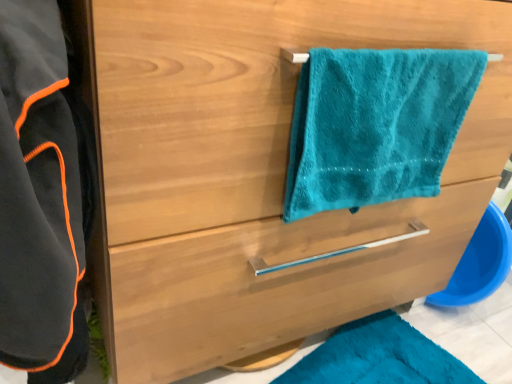
Question: Is teal plush towel at upper right to the left of black fleece bathrobe at left from the viewer's perspective?

Choices:
 (A) yes
 (B) no

Answer: (B)

Question: Considering the relative sizes of teal plush towel at upper right and black fleece bathrobe at left in the image provided, is teal plush towel at upper right shorter than black fleece bathrobe at left?

Choices:
 (A) yes
 (B) no

Answer: (A)

Question: Is teal plush towel at upper right thinner than black fleece bathrobe at left?

Choices:
 (A) no
 (B) yes

Answer: (B)

Question: Is there a large distance between teal plush towel at upper right and black fleece bathrobe at left?

Choices:
 (A) yes
 (B) no

Answer: (B)

Question: From the image's perspective, is teal plush towel at upper right beneath black fleece bathrobe at left?

Choices:
 (A) no
 (B) yes

Answer: (A)

Question: Is the depth of teal plush towel at upper right greater than that of black fleece bathrobe at left?

Choices:
 (A) no
 (B) yes

Answer: (B)

Question: Is black fleece bathrobe at left shorter than teal plush towel at upper right?

Choices:
 (A) no
 (B) yes

Answer: (A)

Question: Considering the relative positions of black fleece bathrobe at left and teal plush towel at upper right in the image provided, is black fleece bathrobe at left to the right of teal plush towel at upper right from the viewer's perspective?

Choices:
 (A) no
 (B) yes

Answer: (A)

Question: Is black fleece bathrobe at left directly adjacent to teal plush towel at upper right?

Choices:
 (A) yes
 (B) no

Answer: (B)

Question: Is black fleece bathrobe at left positioned with its back to teal plush towel at upper right?

Choices:
 (A) no
 (B) yes

Answer: (A)

Question: Does black fleece bathrobe at left lie in front of teal plush towel at upper right?

Choices:
 (A) no
 (B) yes

Answer: (B)

Question: From the image's perspective, is black fleece bathrobe at left under teal plush towel at upper right?

Choices:
 (A) yes
 (B) no

Answer: (A)

Question: Can you confirm if teal plush towel at upper right is thinner than satin wood drawer at center?

Choices:
 (A) yes
 (B) no

Answer: (A)